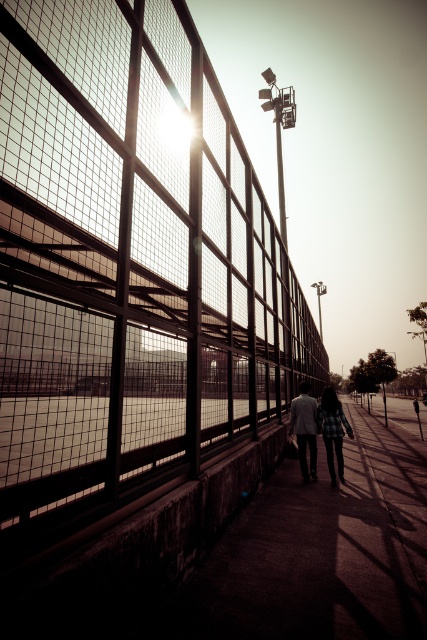
Question: Does plaid fabric couple at center appear under matte gray suit at center?

Choices:
 (A) no
 (B) yes

Answer: (B)

Question: Can you confirm if plaid fabric couple at center is positioned below matte gray suit at center?

Choices:
 (A) no
 (B) yes

Answer: (B)

Question: Which of the following is the farthest from the observer?

Choices:
 (A) plaid fabric couple at center
 (B) metal mesh fence at center

Answer: (A)

Question: Does plaid fabric couple at center lie in front of matte gray suit at center?

Choices:
 (A) yes
 (B) no

Answer: (A)

Question: Which point is farther to the camera?

Choices:
 (A) plaid fabric couple at center
 (B) metal mesh fence at center
 (C) matte gray suit at center

Answer: (C)

Question: Estimate the real-world distances between objects in this image. Which object is closer to the matte gray suit at center?

Choices:
 (A) plaid fabric couple at center
 (B) metal mesh fence at center

Answer: (A)